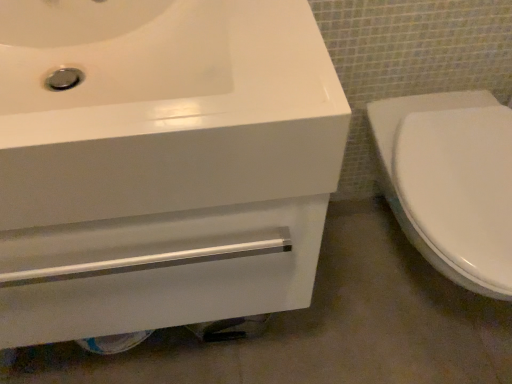
Locate an element on the screen. This screenshot has width=512, height=384. vacant space situated on the left part of white glossy toilet at right is located at coordinates (319, 311).